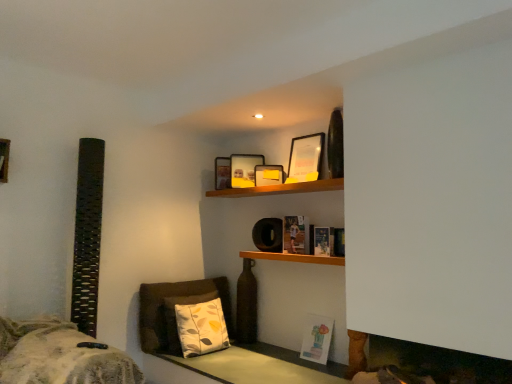
Identify the location of fuzzy gray blanket at lower left. coord(59,356).

What is the approximate height of matte glass picture frame at upper center, which is counted as the 3th picture frame, starting from the front?

It is 31.68 centimeters.

Describe the element at coordinates (323, 241) in the screenshot. I see `hardcover book at center, the 2th book positioned from the top` at that location.

What do you see at coordinates (296, 235) in the screenshot? The height and width of the screenshot is (384, 512). I see `matte paper book at center, marked as the 3th book in a bottom-to-top arrangement` at bounding box center [296, 235].

Find the location of a particular element. This screenshot has height=384, width=512. fuzzy gray blanket at lower left is located at coordinates (59, 356).

Between wooden shelf at upper center, marked as the 2th shelf in a top-to-bottom arrangement, and pastel paper book at lower right, the 1th book positioned from the bottom, which one has larger size?

With larger size is wooden shelf at upper center, marked as the 2th shelf in a top-to-bottom arrangement.

The height and width of the screenshot is (384, 512). In order to click on shelf that is the 2nd object located in front of the pastel paper book at lower right, the 1th book positioned from the bottom in this screenshot , I will do `click(293, 257)`.

Considering the sizes of wooden shelf at upper center, the first shelf positioned from the bottom, and pastel paper book at lower right, the third book from the top, in the image, is wooden shelf at upper center, the first shelf positioned from the bottom, taller or shorter than pastel paper book at lower right, the third book from the top,?

Considering their sizes, wooden shelf at upper center, the first shelf positioned from the bottom, has less height than pastel paper book at lower right, the third book from the top.

From the image's perspective, who appears lower, matte yellow picture frame at upper center, the 2th picture frame from the back, or hardcover book at center, the 2th book from the bottom?

hardcover book at center, the 2th book from the bottom, is shown below in the image.

Can you tell me how much matte yellow picture frame at upper center, the second picture frame when ordered from left to right, and hardcover book at center, the 2th book from the bottom, differ in facing direction?

They differ by 59.6 degrees in their facing directions.

Is matte yellow picture frame at upper center, which is the second picture frame from right to left, completely or partially outside of hardcover book at center, the 2th book from the bottom?

Yes, matte yellow picture frame at upper center, which is the second picture frame from right to left, is located beyond the bounds of hardcover book at center, the 2th book from the bottom.

Is matte paper book at center, which is counted as the 1th book, starting from the top, in front of or behind matte yellow picture frame at upper center, the 2th picture frame from the back, in the image?

Clearly, matte paper book at center, which is counted as the 1th book, starting from the top, is in front of matte yellow picture frame at upper center, the 2th picture frame from the back.

Measure the distance from matte paper book at center, marked as the 3th book in a bottom-to-top arrangement, to matte yellow picture frame at upper center, which ranks as the second picture frame in front-to-back order.

matte paper book at center, marked as the 3th book in a bottom-to-top arrangement, is 17.30 inches away from matte yellow picture frame at upper center, which ranks as the second picture frame in front-to-back order.

Consider the image. Is matte paper book at center, which is counted as the 1th book, starting from the top, oriented away from matte yellow picture frame at upper center, the second picture frame when ordered from left to right?

No, matte paper book at center, which is counted as the 1th book, starting from the top, is not facing the opposite direction of matte yellow picture frame at upper center, the second picture frame when ordered from left to right.

Between matte paper book at center, marked as the 3th book in a bottom-to-top arrangement, and matte yellow picture frame at upper center, which ranks as the second picture frame in front-to-back order, which one appears on the left side from the viewer's perspective?

matte yellow picture frame at upper center, which ranks as the second picture frame in front-to-back order.

From a real-world perspective, is pastel paper book at lower right, the 1th book positioned from the bottom, positioned above or below wooden shelf at upper center, marked as the 1th shelf in a top-to-bottom arrangement?

Clearly, from a real-world perspective, pastel paper book at lower right, the 1th book positioned from the bottom, is below wooden shelf at upper center, marked as the 1th shelf in a top-to-bottom arrangement.

Is pastel paper book at lower right, the 1th book positioned from the bottom, smaller than wooden shelf at upper center, marked as the 1th shelf in a top-to-bottom arrangement?

Yes.

Which of these two, pastel paper book at lower right, the third book from the top, or wooden shelf at upper center, the second shelf when ordered from bottom to top, stands taller?

pastel paper book at lower right, the third book from the top, is taller.

Can you tell me how much pastel paper book at lower right, the 1th book positioned from the bottom, and wooden shelf at upper center, the second shelf when ordered from bottom to top, differ in facing direction?

4.2 degrees separate the facing orientations of pastel paper book at lower right, the 1th book positioned from the bottom, and wooden shelf at upper center, the second shelf when ordered from bottom to top.

Is matte wooden picture frame at upper center, marked as the third picture frame in a back-to-front arrangement, taller or shorter than fuzzy gray blanket at lower left?

In the image, matte wooden picture frame at upper center, marked as the third picture frame in a back-to-front arrangement, appears to be shorter than fuzzy gray blanket at lower left.

Between point (288, 180) and point (72, 346), which one is positioned behind?

The point (288, 180) is farther.

From the image's perspective, does matte wooden picture frame at upper center, the first picture frame from the front, appear lower than fuzzy gray blanket at lower left?

No, from the image's perspective, matte wooden picture frame at upper center, the first picture frame from the front, is not below fuzzy gray blanket at lower left.

Is matte wooden picture frame at upper center, which ranks as the 3th picture frame in left-to-right order, positioned with its back to fuzzy gray blanket at lower left?

That's not correct — matte wooden picture frame at upper center, which ranks as the 3th picture frame in left-to-right order, is not looking away from fuzzy gray blanket at lower left.

Would you consider matte wooden picture frame at upper center, marked as the third picture frame in a back-to-front arrangement, to be distant from matte glass picture frame at upper center, the first picture frame positioned from the back?

They are positioned close to each other.

Considering the positions of point (316, 167) and point (252, 186), is point (316, 167) closer or farther from the camera than point (252, 186)?

Point (316, 167) is closer to the camera than point (252, 186).

Is matte wooden picture frame at upper center, which ranks as the 3th picture frame in left-to-right order, positioned behind matte glass picture frame at upper center, the first picture frame positioned from the back?

No, it is in front of matte glass picture frame at upper center, the first picture frame positioned from the back.

From the image's perspective, is matte wooden picture frame at upper center, the first picture frame positioned from the right, below matte glass picture frame at upper center, which is counted as the 3th picture frame, starting from the front?

No, from the image's perspective, matte wooden picture frame at upper center, the first picture frame positioned from the right, is not beneath matte glass picture frame at upper center, which is counted as the 3th picture frame, starting from the front.

You are a GUI agent. You are given a task and a screenshot of the screen. Output one action in this format:
    pyautogui.click(x=<x>, y=<y>)
    Task: Click on the table below the white fabric pillow at lower center (from a real-world perspective)
    The width and height of the screenshot is (512, 384).
    Given the screenshot: What is the action you would take?
    (x=260, y=366)

Is white fabric pillow at lower center far from smooth wooden table at lower center?

white fabric pillow at lower center is near smooth wooden table at lower center, not far away.

Could you tell me if white fabric pillow at lower center is facing smooth wooden table at lower center?

Yes, white fabric pillow at lower center faces towards smooth wooden table at lower center.

Between white fabric pillow at lower center and smooth wooden table at lower center, which one is positioned behind?

white fabric pillow at lower center is further away from the camera.

Identify the location of book below the wooden shelf at upper center, the first shelf positioned from the bottom (from the image's perspective). (317, 339).

From the hardcover book at center, the 2th book positioned from the top, count 2nd picture frames backward and point to it. Please provide its 2D coordinates.

[(268, 175)]

Which object lies further to the anchor point matte glass picture frame at upper center, the 1th picture frame viewed from the left, white fabric pillow at lower center or matte yellow picture frame at upper center, the second picture frame when ordered from left to right?

white fabric pillow at lower center is further to matte glass picture frame at upper center, the 1th picture frame viewed from the left.

From the image, which object appears to be nearer to matte wooden picture frame at upper center, the first picture frame positioned from the right, pastel paper book at lower right, the 1th book positioned from the bottom, or matte yellow picture frame at upper center, the 2th picture frame from the back?

matte yellow picture frame at upper center, the 2th picture frame from the back, is closer to matte wooden picture frame at upper center, the first picture frame positioned from the right.

Estimate the real-world distances between objects in this image. Which object is further from matte yellow picture frame at upper center, the 2th picture frame from the back, matte glass picture frame at upper center, which ranks as the 3th picture frame in right-to-left order, or pastel paper book at lower right, the 1th book positioned from the bottom?

Among the two, pastel paper book at lower right, the 1th book positioned from the bottom, is located further to matte yellow picture frame at upper center, the 2th picture frame from the back.

When comparing their distances from matte glass picture frame at upper center, which ranks as the 3th picture frame in right-to-left order, does matte yellow picture frame at upper center, the second picture frame when ordered from left to right, or smooth wooden table at lower center seem further?

smooth wooden table at lower center lies further to matte glass picture frame at upper center, which ranks as the 3th picture frame in right-to-left order, than the other object.

Estimate the real-world distances between objects in this image. Which object is closer to smooth wooden table at lower center, hardcover book at center, the 2th book from the bottom, or pastel paper book at lower right, the 1th book positioned from the bottom?

Among the two, pastel paper book at lower right, the 1th book positioned from the bottom, is located nearer to smooth wooden table at lower center.

Considering their positions, is smooth wooden table at lower center positioned closer to wooden shelf at upper center, marked as the 2th shelf in a top-to-bottom arrangement, than matte glass picture frame at upper center, which ranks as the 3th picture frame in right-to-left order?

Based on the image, matte glass picture frame at upper center, which ranks as the 3th picture frame in right-to-left order, appears to be nearer to wooden shelf at upper center, marked as the 2th shelf in a top-to-bottom arrangement.

Based on their spatial positions, is white fabric pillow at lower center or hardcover book at center, the 2th book positioned from the top, closer to smooth wooden table at lower center?

The object closer to smooth wooden table at lower center is white fabric pillow at lower center.

When comparing their distances from white fabric pillow at lower center, does wooden shelf at upper center, marked as the 1th shelf in a top-to-bottom arrangement, or matte glass picture frame at upper center, which ranks as the 3th picture frame in right-to-left order, seem closer?

wooden shelf at upper center, marked as the 1th shelf in a top-to-bottom arrangement, is closer to white fabric pillow at lower center.

Locate an element on the screen. The image size is (512, 384). table located between fuzzy gray blanket at lower left and pastel paper book at lower right, the 1th book positioned from the bottom, in the left-right direction is located at coordinates (260, 366).

Locate an element on the screen. picture frame between matte glass picture frame at upper center, which ranks as the 3th picture frame in right-to-left order, and white fabric pillow at lower center from top to bottom is located at coordinates (268, 175).

Image resolution: width=512 pixels, height=384 pixels. Find the location of `pillow between matte yellow picture frame at upper center, which is the second picture frame from right to left, and smooth wooden table at lower center in the up-down direction`. pillow between matte yellow picture frame at upper center, which is the second picture frame from right to left, and smooth wooden table at lower center in the up-down direction is located at coordinates (201, 328).

This screenshot has width=512, height=384. I want to click on picture frame located between wooden shelf at upper center, the second shelf when ordered from bottom to top, and matte yellow picture frame at upper center, which is the second picture frame from right to left, in the depth direction, so click(x=305, y=158).